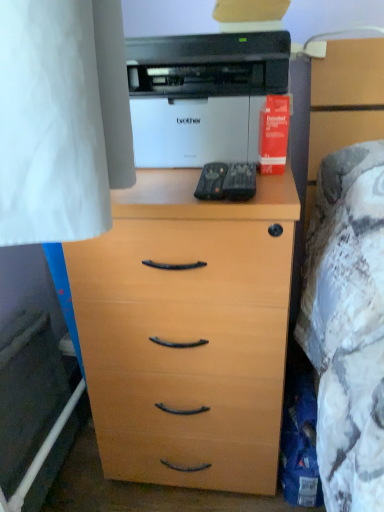
You are a GUI agent. You are given a task and a screenshot of the screen. Output one action in this format:
    pyautogui.click(x=<x>, y=<y>)
    Task: Click on the free space in front of red matte paper at upper right
    Image resolution: width=384 pixels, height=512 pixels.
    Given the screenshot: What is the action you would take?
    pyautogui.click(x=271, y=191)